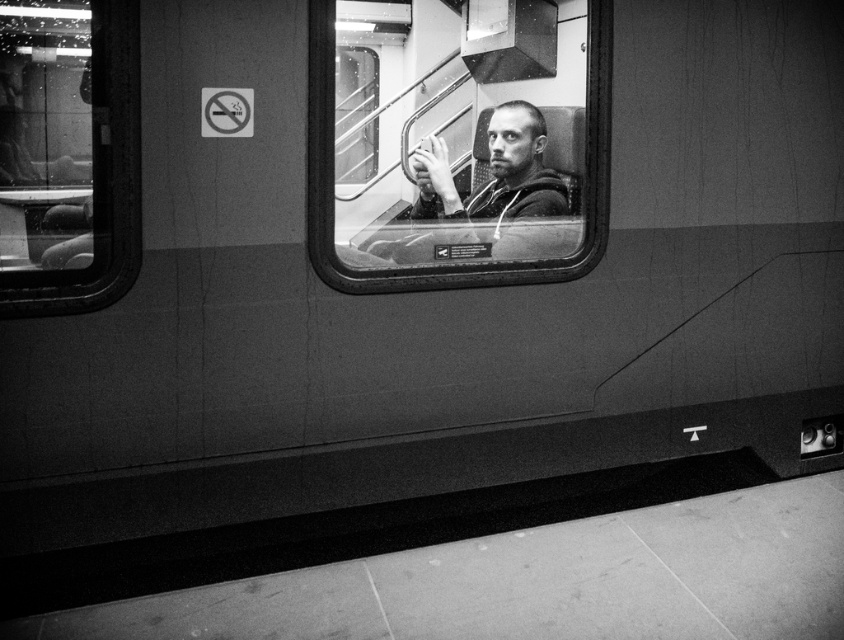
Can you confirm if metallic glass train window at center is smaller than smooth gray hoodie at center?

Incorrect, metallic glass train window at center is not smaller in size than smooth gray hoodie at center.

Measure the distance between point (371, 65) and camera.

Point (371, 65) and camera are 14.28 feet apart from each other.

In order to click on metallic glass train window at center in this screenshot , I will do `click(457, 141)`.

Does clear glass train window at left have a lesser width compared to smooth gray hoodie at center?

Indeed, clear glass train window at left has a lesser width compared to smooth gray hoodie at center.

Is clear glass train window at left positioned at the back of smooth gray hoodie at center?

No, it is not.

The image size is (844, 640). What do you see at coordinates (68, 154) in the screenshot?
I see `clear glass train window at left` at bounding box center [68, 154].

Identify the location of clear glass train window at left. This screenshot has width=844, height=640. (68, 154).

Which of these two, metallic glass train window at center or clear glass train window at left, stands shorter?

Standing shorter between the two is clear glass train window at left.

This screenshot has width=844, height=640. I want to click on metallic glass train window at center, so click(457, 141).